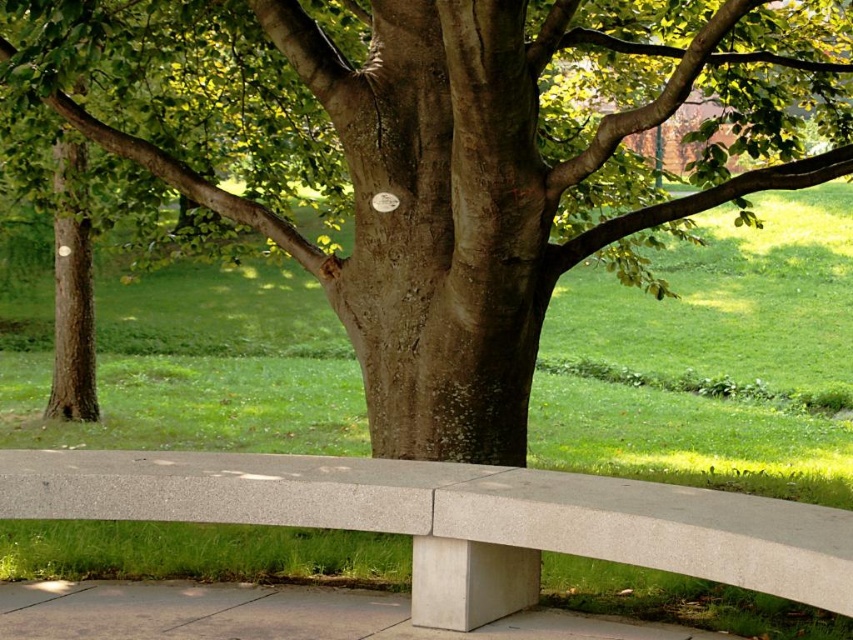
Is point (840, 598) in front of point (91, 614)?

Yes, point (840, 598) is closer to viewer.

Measure the distance between smooth gray bench at center and gray concrete bench at lower center.

smooth gray bench at center is 14.23 inches away from gray concrete bench at lower center.

Is point (25, 484) positioned after point (54, 636)?

Yes, it is.

I want to click on smooth gray bench at center, so click(x=457, y=518).

Between smooth brown tree trunk at center and smooth gray bench at center, which one is positioned higher?

smooth brown tree trunk at center

Who is lower down, smooth brown tree trunk at center or smooth gray bench at center?

smooth gray bench at center

Identify the location of smooth brown tree trunk at center. (444, 154).

Is smooth brown tree trunk at center shorter than gray concrete bench at lower center?

Incorrect, smooth brown tree trunk at center's height does not fall short of gray concrete bench at lower center's.

Between smooth brown tree trunk at center and gray concrete bench at lower center, which one is positioned higher?

smooth brown tree trunk at center

Who is more distant from viewer, (497, 196) or (143, 595)?

The point (497, 196) is more distant.

Identify the location of smooth brown tree trunk at center. This screenshot has width=853, height=640. (444, 154).